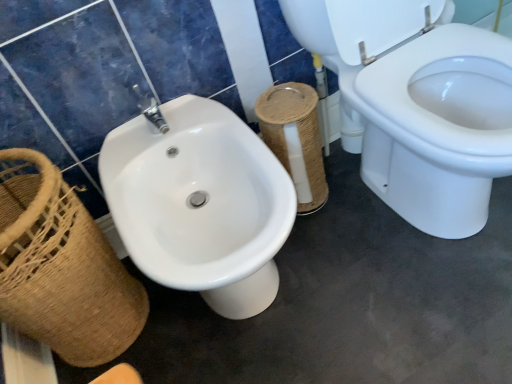
At what (x,y) coordinates should I click in order to perform the action: click on brown woven basket at left. Please return your answer as a coordinate pair (x, y). Looking at the image, I should click on (62, 268).

The image size is (512, 384). What do you see at coordinates (62, 268) in the screenshot?
I see `brown woven basket at left` at bounding box center [62, 268].

Measure the distance between point (92,283) and camera.

Point (92,283) is 95.70 centimeters from camera.

This screenshot has width=512, height=384. What do you see at coordinates (295, 140) in the screenshot?
I see `woven brown toilet paper at center` at bounding box center [295, 140].

The height and width of the screenshot is (384, 512). What are the coordinates of `woven brown toilet paper at center` in the screenshot? It's located at (295, 140).

At what (x,y) coordinates should I click in order to perform the action: click on brown woven basket at left. Please return your answer as a coordinate pair (x, y). Looking at the image, I should click on (62, 268).

Which object is positioned more to the left, brown woven basket at left or woven brown toilet paper at center?

From the viewer's perspective, brown woven basket at left appears more on the left side.

Considering their positions, is brown woven basket at left located in front of or behind woven brown toilet paper at center?

Clearly, brown woven basket at left is in front of woven brown toilet paper at center.

Is point (87, 231) positioned in front of point (269, 95)?

Yes, it is.

Based on the photo, from the image's perspective, who appears lower, brown woven basket at left or woven brown toilet paper at center?

brown woven basket at left, from the image's perspective.

From a real-world perspective, is brown woven basket at left on woven brown toilet paper at center?

Yes, from a real-world perspective, brown woven basket at left is above woven brown toilet paper at center.

Which of these two, brown woven basket at left or woven brown toilet paper at center, is thinner?

woven brown toilet paper at center is thinner.

From the picture: Who is taller, brown woven basket at left or woven brown toilet paper at center?

With more height is brown woven basket at left.

Is brown woven basket at left bigger than woven brown toilet paper at center?

Correct, brown woven basket at left is larger in size than woven brown toilet paper at center.

Is woven brown toilet paper at center located within brown woven basket at left?

Definitely not — woven brown toilet paper at center is not inside brown woven basket at left.

Is brown woven basket at left not near woven brown toilet paper at center?

No, brown woven basket at left is not far away from woven brown toilet paper at center.

Could you tell me if brown woven basket at left is facing woven brown toilet paper at center?

No, brown woven basket at left is not oriented towards woven brown toilet paper at center.

Where is `basket in front of the woven brown toilet paper at center`? This screenshot has width=512, height=384. basket in front of the woven brown toilet paper at center is located at coordinates (62, 268).

Visually, is woven brown toilet paper at center positioned to the left or to the right of brown woven basket at left?

woven brown toilet paper at center is to the right of brown woven basket at left.

From the picture: Considering the relative positions of woven brown toilet paper at center and brown woven basket at left in the image provided, is woven brown toilet paper at center behind brown woven basket at left?

Yes, woven brown toilet paper at center is behind brown woven basket at left.

Is point (317, 138) closer or farther from the camera than point (90, 265)?

Point (317, 138) appears to be farther away from the viewer than point (90, 265).

From the image's perspective, is woven brown toilet paper at center below brown woven basket at left?

No, from the image's perspective, woven brown toilet paper at center is not beneath brown woven basket at left.

From a real-world perspective, is woven brown toilet paper at center located beneath brown woven basket at left?

Correct, in the physical world, woven brown toilet paper at center is lower than brown woven basket at left.

Looking at their sizes, would you say woven brown toilet paper at center is wider or thinner than brown woven basket at left?

Considering their sizes, woven brown toilet paper at center looks slimmer than brown woven basket at left.

Does woven brown toilet paper at center have a lesser height compared to brown woven basket at left?

Correct, woven brown toilet paper at center is not as tall as brown woven basket at left.

Consider the image. Which of these two, woven brown toilet paper at center or brown woven basket at left, is smaller?

woven brown toilet paper at center.

Is woven brown toilet paper at center completely or partially outside of brown woven basket at left?

Yes.

Are woven brown toilet paper at center and brown woven basket at left beside each other?

No, woven brown toilet paper at center is not next to brown woven basket at left.

Based on the photo, does woven brown toilet paper at center turn towards brown woven basket at left?

No, woven brown toilet paper at center does not turn towards brown woven basket at left.

You are a GUI agent. You are given a task and a screenshot of the screen. Output one action in this format:
    pyautogui.click(x=<x>, y=<y>)
    Task: Click on the toilet paper behind the brown woven basket at left
    The image size is (512, 384).
    Given the screenshot: What is the action you would take?
    pyautogui.click(x=295, y=140)

Identify the location of toilet paper located above the brown woven basket at left (from the image's perspective). (295, 140).

The height and width of the screenshot is (384, 512). I want to click on toilet paper behind the brown woven basket at left, so click(295, 140).